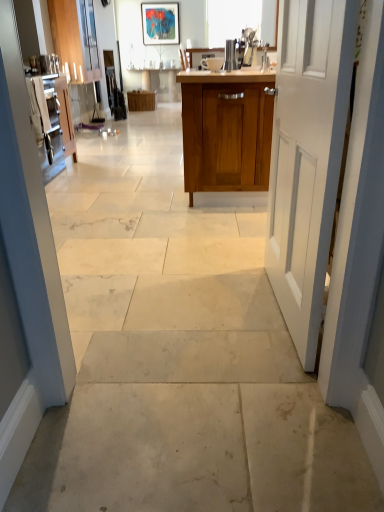
This screenshot has height=512, width=384. Describe the element at coordinates (226, 130) in the screenshot. I see `wooden cabinet at center, arranged as the first cabinetry when viewed from the front` at that location.

Describe the element at coordinates (75, 38) in the screenshot. I see `matte wood cabinet at upper left, the second cabinetry when ordered from front to back` at that location.

You are a GUI agent. You are given a task and a screenshot of the screen. Output one action in this format:
    pyautogui.click(x=<x>, y=<y>)
    Task: Click on the wooden cabinet at center, arranged as the first cabinetry when viewed from the front
    
    Given the screenshot: What is the action you would take?
    pyautogui.click(x=226, y=130)

Considering the relative sizes of matte acrylic painting at upper center and matte wood cabinet at upper left, positioned as the 1th cabinetry in left-to-right order, in the image provided, is matte acrylic painting at upper center wider than matte wood cabinet at upper left, positioned as the 1th cabinetry in left-to-right order,?

Incorrect, the width of matte acrylic painting at upper center does not surpass that of matte wood cabinet at upper left, positioned as the 1th cabinetry in left-to-right order.

How many degrees apart are the facing directions of matte acrylic painting at upper center and matte wood cabinet at upper left, placed as the first cabinetry when sorted from back to front?

matte acrylic painting at upper center and matte wood cabinet at upper left, placed as the first cabinetry when sorted from back to front, are facing 89.6 degrees away from each other.

Is matte acrylic painting at upper center taller or shorter than matte wood cabinet at upper left, the second cabinetry when ordered from front to back?

Considering their sizes, matte acrylic painting at upper center has less height than matte wood cabinet at upper left, the second cabinetry when ordered from front to back.

Is matte wood cabinet at upper left, placed as the first cabinetry when sorted from back to front, at the back of matte acrylic painting at upper center?

matte acrylic painting at upper center is not turned away from matte wood cabinet at upper left, placed as the first cabinetry when sorted from back to front.

Which is less distant, (149,34) or (291,208)?

Point (149,34) is positioned farther from the camera compared to point (291,208).

Can you confirm if matte acrylic painting at upper center is smaller than white matte door at right?

Yes, matte acrylic painting at upper center is smaller than white matte door at right.

From a real-world perspective, which object stands above the other?

matte acrylic painting at upper center.

Does matte acrylic painting at upper center have a greater width compared to white matte door at right?

Incorrect, the width of matte acrylic painting at upper center does not surpass that of white matte door at right.

Is white matte door at right inside satin silver kettle at center?

Definitely not — white matte door at right is not inside satin silver kettle at center.

Is satin silver kettle at center positioned behind white matte door at right?

That is True.

Where is `door below the satin silver kettle at center (from the image's perspective)`? door below the satin silver kettle at center (from the image's perspective) is located at coordinates (307, 157).

Does wooden cabinet at center, which is the 2th cabinetry in top-to-bottom order, lie in front of satin silver kettle at center?

Yes, it is.

Is wooden cabinet at center, which is the second cabinetry in left-to-right order, not near satin silver kettle at center?

wooden cabinet at center, which is the second cabinetry in left-to-right order, is actually quite close to satin silver kettle at center.

Considering the positions of points (219, 110) and (226, 42), is point (219, 110) closer to camera compared to point (226, 42)?

That is True.

From the picture: Could you tell me if wooden cabinet at center, which is the 2th cabinetry in top-to-bottom order, is facing satin silver kettle at center?

No, wooden cabinet at center, which is the 2th cabinetry in top-to-bottom order, does not turn towards satin silver kettle at center.

Does matte wood cabinet at upper left, the second cabinetry positioned from the bottom, touch white matte door at right?

No, matte wood cabinet at upper left, the second cabinetry positioned from the bottom, is not next to white matte door at right.

Is matte wood cabinet at upper left, placed as the first cabinetry when sorted from back to front, to the left or to the right of white matte door at right in the image?

In the image, matte wood cabinet at upper left, placed as the first cabinetry when sorted from back to front, appears on the left side of white matte door at right.

What's the angular difference between matte wood cabinet at upper left, which ranks as the 2th cabinetry in right-to-left order, and white matte door at right's facing directions?

There is a 177-degree angle between the facing directions of matte wood cabinet at upper left, which ranks as the 2th cabinetry in right-to-left order, and white matte door at right.

Considering the relative sizes of matte acrylic painting at upper center and satin silver kettle at center in the image provided, is matte acrylic painting at upper center taller than satin silver kettle at center?

Yes.

From a real-world perspective, is matte acrylic painting at upper center physically below satin silver kettle at center?

No, from a real-world perspective, matte acrylic painting at upper center is not beneath satin silver kettle at center.

Would you consider matte acrylic painting at upper center to be distant from satin silver kettle at center?

That's right, there is a large distance between matte acrylic painting at upper center and satin silver kettle at center.

From the picture: Considering the relative sizes of white matte door at right and satin silver kettle at center in the image provided, is white matte door at right bigger than satin silver kettle at center?

Correct, white matte door at right is larger in size than satin silver kettle at center.

Could you tell me if white matte door at right is facing satin silver kettle at center?

No, white matte door at right is not turned towards satin silver kettle at center.

Does white matte door at right lie in front of satin silver kettle at center?

Yes, white matte door at right is closer to the camera.

Is point (281, 269) positioned behind point (227, 66)?

No, (281, 269) is in front of (227, 66).

This screenshot has height=512, width=384. In order to click on the 1st cabinetry located beneath the matte acrylic painting at upper center (from a real-world perspective) in this screenshot , I will do `click(75, 38)`.

Find the location of `door in front of the matte acrylic painting at upper center`. door in front of the matte acrylic painting at upper center is located at coordinates (307, 157).

From the image, which object appears to be farther from wooden cabinet at center, which is the 2th cabinetry in top-to-bottom order, matte wood cabinet at upper left, the second cabinetry when ordered from front to back, or matte acrylic painting at upper center?

matte acrylic painting at upper center lies further to wooden cabinet at center, which is the 2th cabinetry in top-to-bottom order, than the other object.

Looking at the image, which one is located closer to white matte door at right, wooden cabinet at center, which is the second cabinetry in left-to-right order, or matte acrylic painting at upper center?

Based on the image, wooden cabinet at center, which is the second cabinetry in left-to-right order, appears to be nearer to white matte door at right.

Which object lies further to the anchor point wooden cabinet at center, which is the first cabinetry from right to left, satin silver kettle at center or white matte door at right?

Among the two, white matte door at right is located further to wooden cabinet at center, which is the first cabinetry from right to left.

Based on their spatial positions, is matte wood cabinet at upper left, which ranks as the 2th cabinetry in right-to-left order, or satin silver kettle at center further from white matte door at right?

matte wood cabinet at upper left, which ranks as the 2th cabinetry in right-to-left order, is positioned further to the anchor white matte door at right.

Looking at this image, estimate the real-world distances between objects in this image. Which object is further from matte acrylic painting at upper center, matte wood cabinet at upper left, the second cabinetry positioned from the bottom, or satin silver kettle at center?

satin silver kettle at center.

Looking at the image, which one is located closer to wooden cabinet at center, which is the 2th cabinetry in top-to-bottom order, matte wood cabinet at upper left, which appears as the first cabinetry when viewed from the top, or white matte door at right?

white matte door at right is positioned closer to the anchor wooden cabinet at center, which is the 2th cabinetry in top-to-bottom order.

From the image, which object appears to be farther from wooden cabinet at center, which is the second cabinetry in left-to-right order, matte acrylic painting at upper center or white matte door at right?

The object further to wooden cabinet at center, which is the second cabinetry in left-to-right order, is matte acrylic painting at upper center.

Considering their positions, is white matte door at right positioned closer to matte wood cabinet at upper left, which appears as the first cabinetry when viewed from the top, than wooden cabinet at center, which is the 2th cabinetry in back-to-front order?

wooden cabinet at center, which is the 2th cabinetry in back-to-front order, is positioned closer to the anchor matte wood cabinet at upper left, which appears as the first cabinetry when viewed from the top.

Identify the location of cabinetry between white matte door at right and matte wood cabinet at upper left, the second cabinetry positioned from the bottom, in the front-back direction. (226, 130).

This screenshot has width=384, height=512. Find the location of `appliance between wooden cabinet at center, the 1th cabinetry when ordered from bottom to top, and matte wood cabinet at upper left, positioned as the 1th cabinetry in left-to-right order, from front to back`. appliance between wooden cabinet at center, the 1th cabinetry when ordered from bottom to top, and matte wood cabinet at upper left, positioned as the 1th cabinetry in left-to-right order, from front to back is located at coordinates (230, 55).

Find the location of a particular element. The width and height of the screenshot is (384, 512). cabinetry between wooden cabinet at center, which is the 2th cabinetry in back-to-front order, and matte acrylic painting at upper center in the front-back direction is located at coordinates (75, 38).

This screenshot has width=384, height=512. What are the coordinates of `appliance between white matte door at right and matte wood cabinet at upper left, the second cabinetry positioned from the bottom, along the z-axis` in the screenshot? It's located at (230, 55).